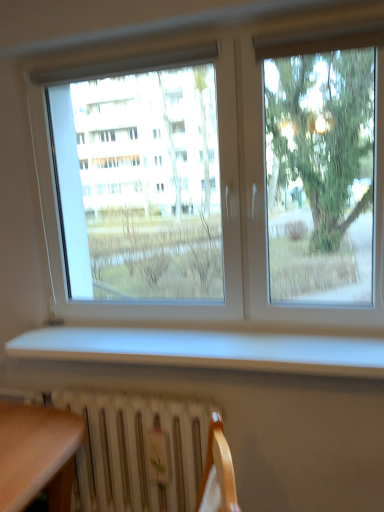
Question: From the image's perspective, is transparent glass window at center beneath white matte window sill at lower center?

Choices:
 (A) yes
 (B) no

Answer: (B)

Question: Does transparent glass window at center have a greater height compared to white matte window sill at lower center?

Choices:
 (A) yes
 (B) no

Answer: (A)

Question: Would you say transparent glass window at center contains white matte window sill at lower center?

Choices:
 (A) no
 (B) yes

Answer: (A)

Question: Is transparent glass window at center behind white matte window sill at lower center?

Choices:
 (A) yes
 (B) no

Answer: (A)

Question: Does transparent glass window at center have a larger size compared to white matte window sill at lower center?

Choices:
 (A) no
 (B) yes

Answer: (B)

Question: From the image's perspective, is white metallic radiator at lower center located above or below white matte window sill at lower center?

Choices:
 (A) above
 (B) below

Answer: (B)

Question: Looking at the image, does white metallic radiator at lower center seem bigger or smaller compared to white matte window sill at lower center?

Choices:
 (A) big
 (B) small

Answer: (A)

Question: Is point (147, 439) positioned closer to the camera than point (180, 361)?

Choices:
 (A) farther
 (B) closer

Answer: (A)

Question: Visually, is white metallic radiator at lower center positioned to the left or to the right of white matte window sill at lower center?

Choices:
 (A) right
 (B) left

Answer: (B)

Question: From a real-world perspective, is white matte window sill at lower center physically located above or below white metallic radiator at lower center?

Choices:
 (A) below
 (B) above

Answer: (B)

Question: Considering the positions of point (173, 357) and point (82, 450), is point (173, 357) closer or farther from the camera than point (82, 450)?

Choices:
 (A) closer
 (B) farther

Answer: (A)

Question: Is white matte window sill at lower center wider or thinner than white metallic radiator at lower center?

Choices:
 (A) thin
 (B) wide

Answer: (B)

Question: Is white matte window sill at lower center in front of or behind white metallic radiator at lower center in the image?

Choices:
 (A) behind
 (B) front

Answer: (B)

Question: Is transparent glass window at center wider or thinner than white matte window sill at lower center?

Choices:
 (A) wide
 (B) thin

Answer: (B)

Question: From their relative heights in the image, would you say transparent glass window at center is taller or shorter than white matte window sill at lower center?

Choices:
 (A) tall
 (B) short

Answer: (A)